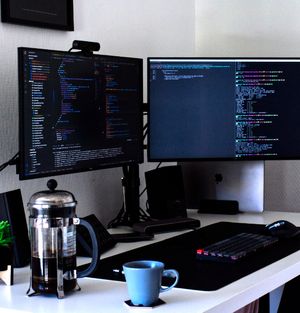
This screenshot has height=313, width=300. What are the coordinates of `computer monitor` in the screenshot? It's located at (196, 112).